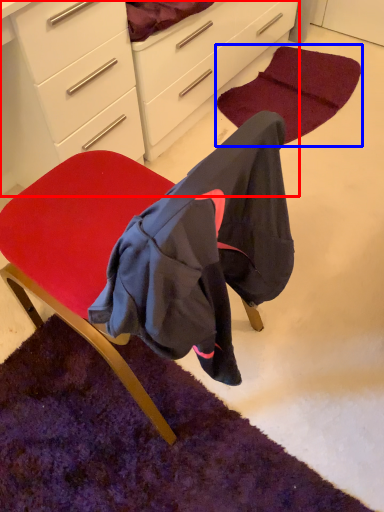
Question: Which object appears closest to the camera in this image, cabinetry (highlighted by a red box) or mat (highlighted by a blue box)?

Choices:
 (A) cabinetry
 (B) mat

Answer: (A)